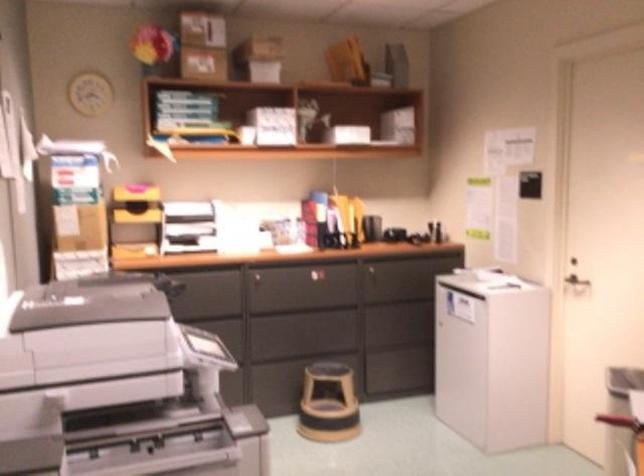
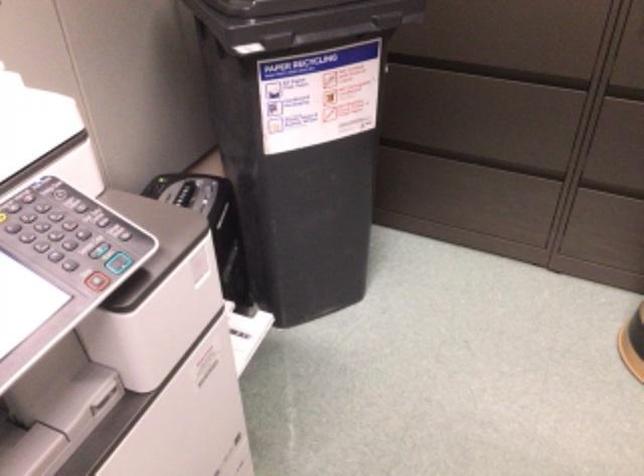
Find the pixel in the second image that matches the point at 268,363 in the first image.

(614, 180)